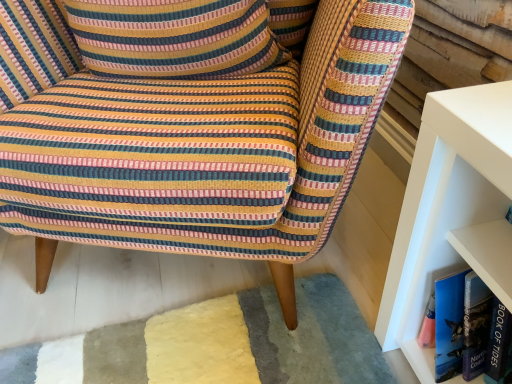
Question: Is blue hardcover book at right taller or shorter than striped fabric pillow at upper left?

Choices:
 (A) short
 (B) tall

Answer: (B)

Question: Considering the positions of blue hardcover book at right and striped fabric pillow at upper left in the image, is blue hardcover book at right wider or thinner than striped fabric pillow at upper left?

Choices:
 (A) thin
 (B) wide

Answer: (A)

Question: Considering the real-world distances, which object is farthest from the striped fabric chair at center?

Choices:
 (A) blue hardcover book at right
 (B) striped fabric pillow at upper left

Answer: (A)

Question: Which object is positioned farthest from the striped fabric chair at center?

Choices:
 (A) blue hardcover book at right
 (B) striped fabric pillow at upper left

Answer: (A)